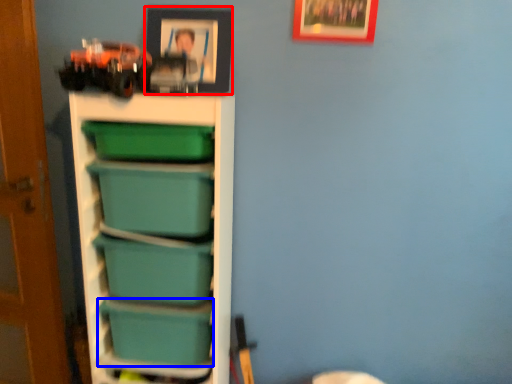
Question: Which object appears closest to the camera in this image, picture frame (highlighted by a red box) or box (highlighted by a blue box)?

Choices:
 (A) picture frame
 (B) box

Answer: (A)